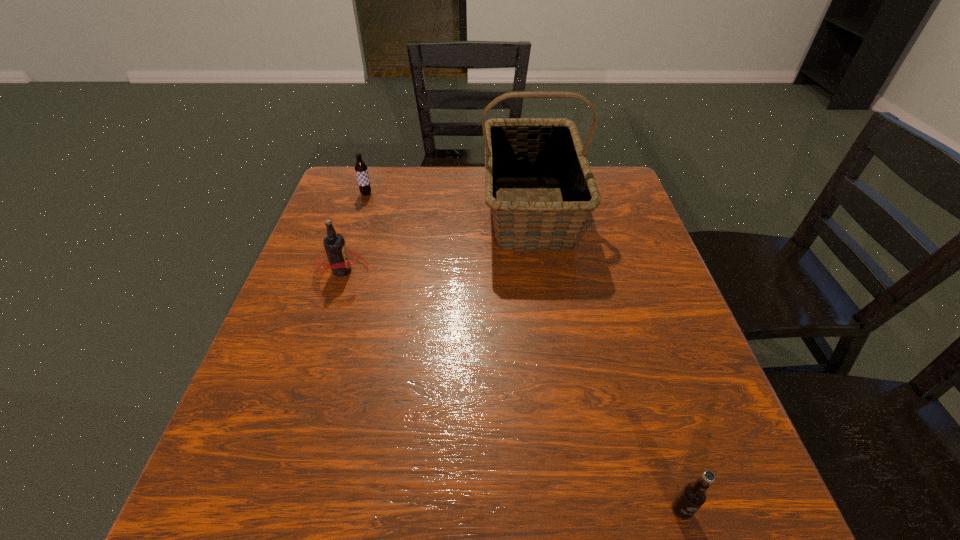
Locate an element on the screen. root beer at the far edge is located at coordinates (361, 169).

This screenshot has height=540, width=960. I want to click on object positioned at the near edge, so click(693, 495).

Where is `basket at the right edge`? basket at the right edge is located at coordinates (516, 149).

Locate an element on the screen. The width and height of the screenshot is (960, 540). root beer present at the right edge is located at coordinates (693, 495).

What are the coordinates of `object at the far left corner` in the screenshot? It's located at (361, 169).

Locate an element on the screen. object positioned at the far right corner is located at coordinates (516, 149).

Where is `object positioned at the near right corner`? This screenshot has width=960, height=540. object positioned at the near right corner is located at coordinates (693, 495).

In the image, there is a desktop. Identify the location of free space at the far edge. Image resolution: width=960 pixels, height=540 pixels. (404, 206).

Locate an element on the screen. Image resolution: width=960 pixels, height=540 pixels. vacant space at the near edge of the desktop is located at coordinates (384, 534).

You are a GUI agent. You are given a task and a screenshot of the screen. Output one action in this format:
    pyautogui.click(x=<x>, y=<y>)
    Task: Click on the vacant space at the left edge of the desktop
    This screenshot has height=540, width=960.
    Given the screenshot: What is the action you would take?
    pyautogui.click(x=317, y=313)